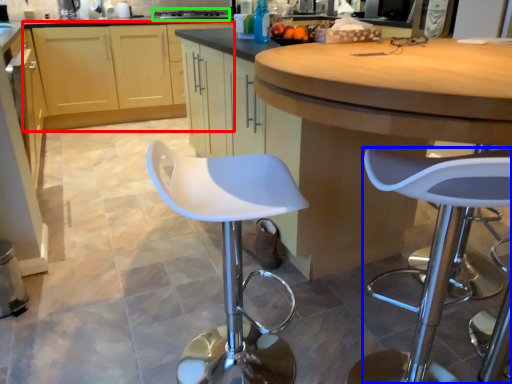
Question: Which is nearer to the cabinetry (highlighted by a red box)? stool (highlighted by a blue box) or stove (highlighted by a green box).

Choices:
 (A) stool
 (B) stove

Answer: (B)